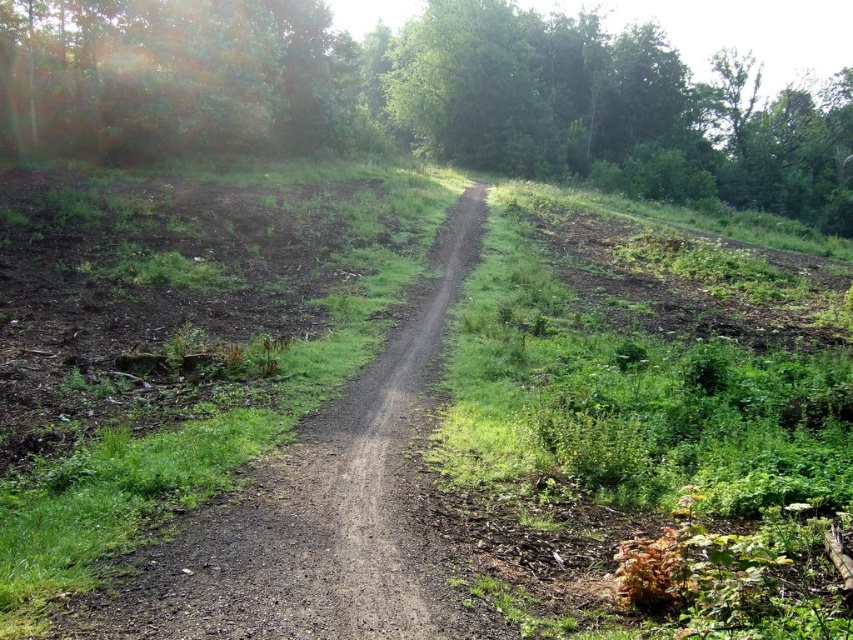
Can you confirm if green leafy tree at center is smaller than dirt/gravel trail at center?

No, green leafy tree at center is not smaller than dirt/gravel trail at center.

Between point (170, 52) and point (289, 589), which one is positioned behind?

Positioned behind is point (170, 52).

Locate an element on the screen. The width and height of the screenshot is (853, 640). green leafy tree at center is located at coordinates (422, 97).